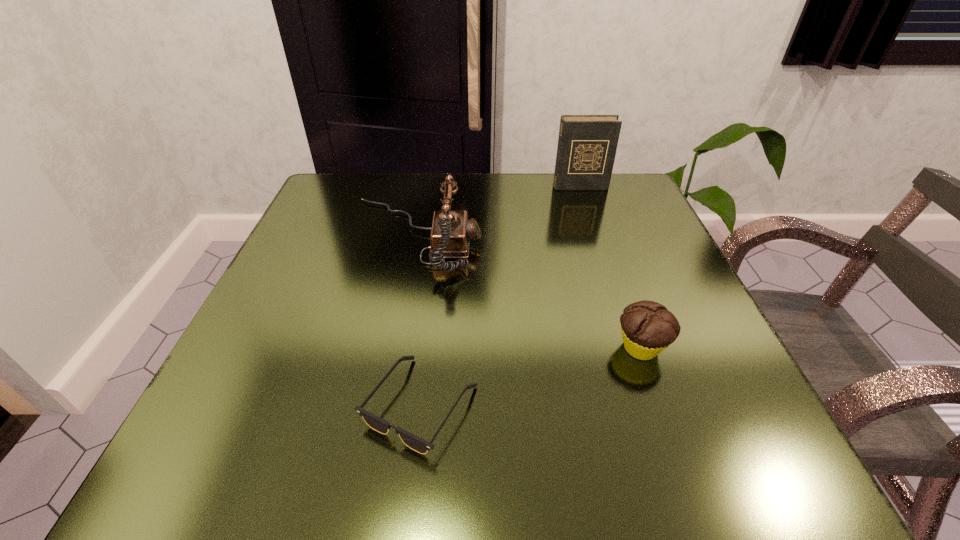
Find the location of a particular element. The height and width of the screenshot is (540, 960). empty space that is in between the third shortest object and the third tallest object is located at coordinates (528, 292).

You are a GUI agent. You are given a task and a screenshot of the screen. Output one action in this format:
    pyautogui.click(x=<x>, y=<y>)
    Task: Click on the blank region between the telephone and the sunglasses
    The width and height of the screenshot is (960, 540).
    Given the screenshot: What is the action you would take?
    pyautogui.click(x=418, y=321)

The height and width of the screenshot is (540, 960). What are the coordinates of `vacant space that is in between the shortest object and the muffin` in the screenshot? It's located at (531, 376).

Choose which object is the third nearest neighbor to the third tallest object. Please provide its 2D coordinates. Your answer should be formatted as a tuple, i.e. [(x, y)], where the tuple contains the x and y coordinates of a point satisfying the conditions above.

[(587, 144)]

Select which object is the closest to the shortest object. Please provide its 2D coordinates. Your answer should be formatted as a tuple, i.e. [(x, y)], where the tuple contains the x and y coordinates of a point satisfying the conditions above.

[(451, 233)]

In order to click on free location that satisfies the following two spatial constraints: 1. on the front cover of the farthest object; 2. on the dial of the second farthest object in this screenshot , I will do `click(596, 237)`.

Identify the location of vacant space that satisfies the following two spatial constraints: 1. on the front cover of the farthest object; 2. on the dial of the second farthest object. (596, 237).

In order to click on free space that satisfies the following two spatial constraints: 1. on the front cover of the farthest object; 2. on the right side of the muffin in this screenshot , I will do `click(635, 348)`.

This screenshot has height=540, width=960. In order to click on free spot that satisfies the following two spatial constraints: 1. on the back side of the third tallest object; 2. on the dial of the second farthest object in this screenshot , I will do `click(602, 237)`.

You are a GUI agent. You are given a task and a screenshot of the screen. Output one action in this format:
    pyautogui.click(x=<x>, y=<y>)
    Task: Click on the vacant space that satisfies the following two spatial constraints: 1. on the front cover of the tallest object; 2. on the right side of the second shortest object
    
    Given the screenshot: What is the action you would take?
    pyautogui.click(x=635, y=348)